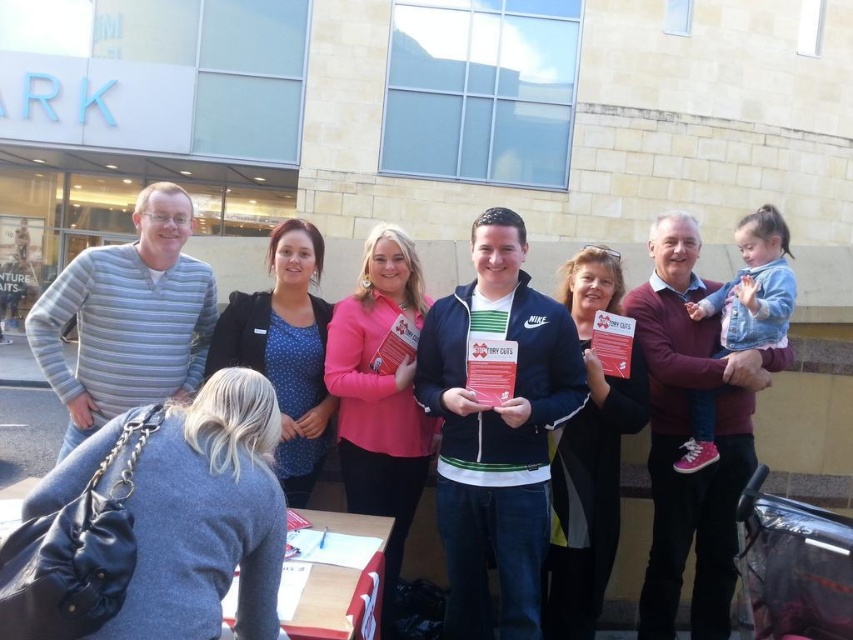
You are a photographer trying to adjust your camera focus to capture both the striped cotton shirt at center and the maroon sweater at upper right in the same frame. Which object should you focus on first to ensure the closest subject is properly in focus?

The striped cotton shirt at center has a lesser height compared to maroon sweater at upper right, so you should focus on the striped cotton shirt at center first since it is closer to the camera.

You are a photographer trying to capture a group photo of the striped cotton shirt at center and the gray striped sweater at left. The camera you are using has a maximum focus range of 4 feet. Can you fit both subjects within the camera range without moving either of them?

The distance between the striped cotton shirt at center and the gray striped sweater at left is 3.74 feet, which is within the camera maximum focus range of 4 feet. Therefore, you can fit both subjects within the camera range without moving them.